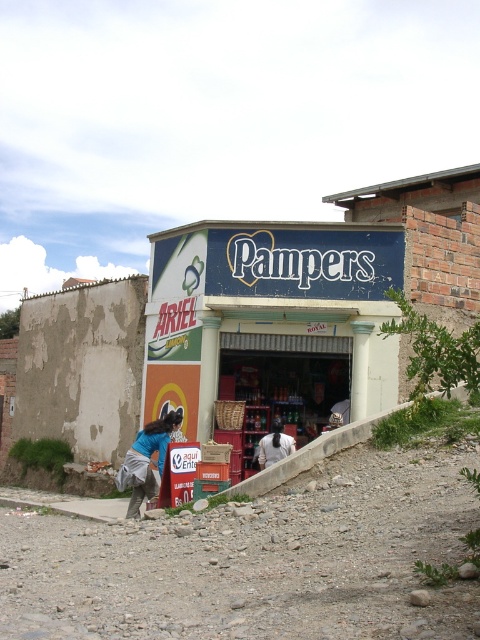
Which of these two, blue matte signboard at center or blue fabric shirt at lower center, stands shorter?

Standing shorter between the two is blue matte signboard at center.

Does point (208, 365) come behind point (131, 516)?

Yes, it is behind point (131, 516).

At what (x,y) coordinates should I click in order to perform the action: click on blue matte signboard at center. Please return your answer as a coordinate pair (x, y). Looking at the image, I should click on (271, 317).

Can you confirm if blue matte signboard at center is positioned to the left of white fabric at center?

In fact, blue matte signboard at center is to the right of white fabric at center.

Can you confirm if blue matte signboard at center is wider than white fabric at center?

Indeed, blue matte signboard at center has a greater width compared to white fabric at center.

Is point (344, 380) positioned behind point (267, 449)?

That is True.

Where is `blue matte signboard at center`? This screenshot has height=640, width=480. blue matte signboard at center is located at coordinates (271, 317).

Where is `blue fabric shirt at lower center`? blue fabric shirt at lower center is located at coordinates (145, 460).

Between point (156, 465) and point (279, 436), which one is positioned behind?

The point (279, 436) is behind.

Locate an element on the screen. blue fabric shirt at lower center is located at coordinates (145, 460).